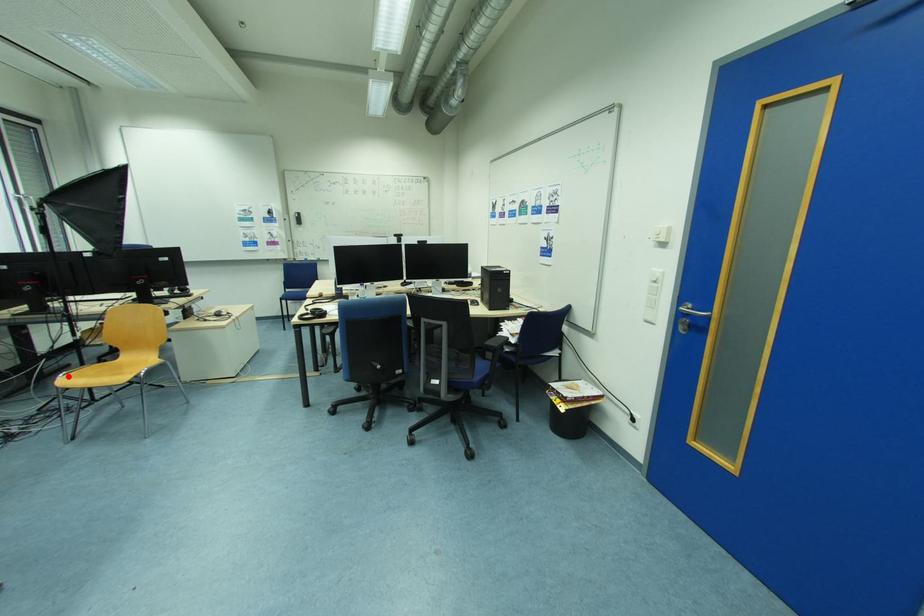
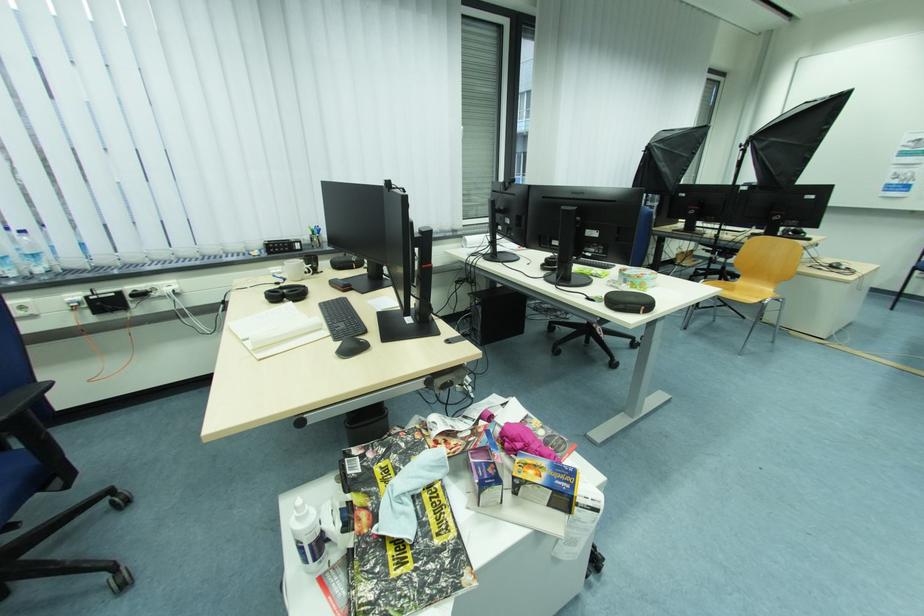
Question: I am providing you with two images of the same scene from different viewpoints. A red point is marked on the first image. Is the red point's position out of view in image 2?

Choices:
 (A) Yes
 (B) No

Answer: (B)